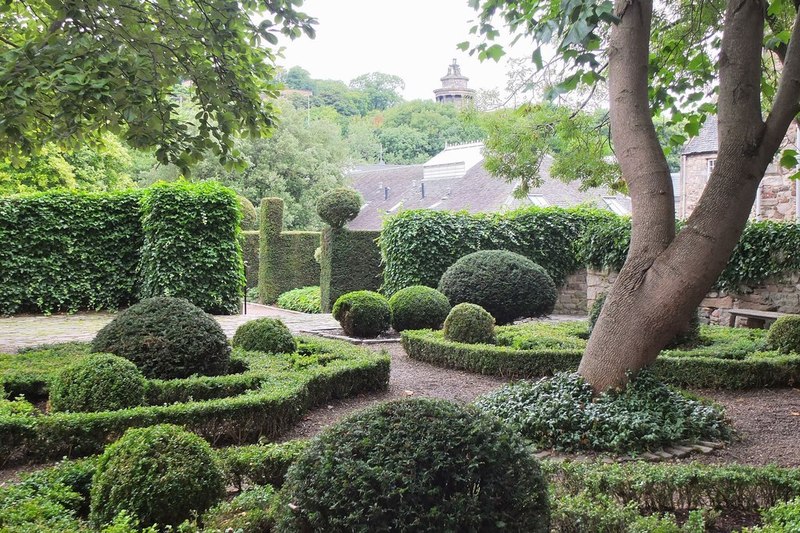
At what (x,y) coordinates should I click in order to perform the action: click on place to sit. Please return your answer as a coordinate pair (x, y). The height and width of the screenshot is (533, 800). Looking at the image, I should click on (752, 311).